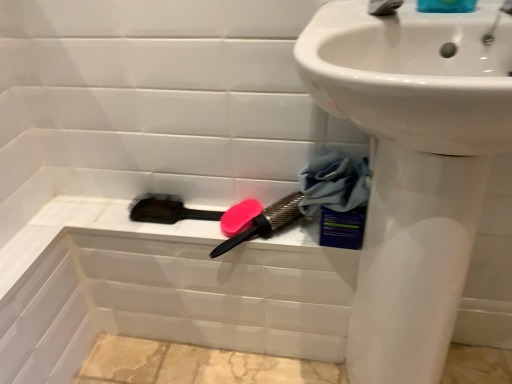
Describe the element at coordinates (334, 184) in the screenshot. I see `blue fabric at lower right` at that location.

Find the location of a particular element. This screenshot has height=384, width=512. blue fabric at lower right is located at coordinates (334, 184).

The height and width of the screenshot is (384, 512). What are the coordinates of `blue glossy soap at upper right` in the screenshot? It's located at (446, 6).

Measure the distance between point (270, 215) and camera.

Point (270, 215) and camera are 91.20 centimeters apart.

This screenshot has width=512, height=384. Find the location of `blue fabric at lower right`. blue fabric at lower right is located at coordinates (334, 184).

How much distance is there between black bristle brush at lower center, which ranks as the 1th brush in left-to-right order, and pink rubber brush at upper center, which appears as the 1th brush when viewed from the right?

A distance of 5.33 inches exists between black bristle brush at lower center, which ranks as the 1th brush in left-to-right order, and pink rubber brush at upper center, which appears as the 1th brush when viewed from the right.

Is pink rubber brush at upper center, which appears as the 1th brush when viewed from the right, at the back of black bristle brush at lower center, positioned as the 2th brush in right-to-left order?

That's not correct — black bristle brush at lower center, positioned as the 2th brush in right-to-left order, is not looking away from pink rubber brush at upper center, which appears as the 1th brush when viewed from the right.

From a real-world perspective, is black bristle brush at lower center, which ranks as the 1th brush in left-to-right order, physically below pink rubber brush at upper center, the 2th brush positioned from the left?

Yes.

Does pink rubber brush at upper center, which appears as the 1th brush when viewed from the right, touch blue glossy soap at upper right?

No, pink rubber brush at upper center, which appears as the 1th brush when viewed from the right, is not touching blue glossy soap at upper right.

Is pink rubber brush at upper center, the 2th brush positioned from the left, facing towards blue glossy soap at upper right?

No, pink rubber brush at upper center, the 2th brush positioned from the left, is not oriented towards blue glossy soap at upper right.

From the picture: From the image's perspective, is pink rubber brush at upper center, the 2th brush positioned from the left, beneath blue glossy soap at upper right?

Correct, pink rubber brush at upper center, the 2th brush positioned from the left, appears lower than blue glossy soap at upper right in the image.

Considering the relative positions of pink rubber brush at upper center, which appears as the 1th brush when viewed from the right, and blue glossy soap at upper right in the image provided, is pink rubber brush at upper center, which appears as the 1th brush when viewed from the right, to the left or to the right of blue glossy soap at upper right?

Based on their positions, pink rubber brush at upper center, which appears as the 1th brush when viewed from the right, is located to the left of blue glossy soap at upper right.

Who is taller, silver metallic tap at upper right or black bristle brush at lower center, positioned as the 2th brush in right-to-left order?

silver metallic tap at upper right.

Is silver metallic tap at upper right oriented away from black bristle brush at lower center, positioned as the 2th brush in right-to-left order?

silver metallic tap at upper right does not have its back to black bristle brush at lower center, positioned as the 2th brush in right-to-left order.

Considering the relative sizes of silver metallic tap at upper right and black bristle brush at lower center, which ranks as the 1th brush in left-to-right order, in the image provided, is silver metallic tap at upper right bigger than black bristle brush at lower center, which ranks as the 1th brush in left-to-right order,?

No, silver metallic tap at upper right is not bigger than black bristle brush at lower center, which ranks as the 1th brush in left-to-right order.

Is silver metallic tap at upper right wider than black bristle brush at lower center, which ranks as the 1th brush in left-to-right order?

Indeed, silver metallic tap at upper right has a greater width compared to black bristle brush at lower center, which ranks as the 1th brush in left-to-right order.

Which of these two, white glossy sink at upper right or black bristle brush at lower center, positioned as the 2th brush in right-to-left order, is thinner?

Thinner between the two is black bristle brush at lower center, positioned as the 2th brush in right-to-left order.

Considering the positions of objects white glossy sink at upper right and black bristle brush at lower center, positioned as the 2th brush in right-to-left order, in the image provided, who is in front, white glossy sink at upper right or black bristle brush at lower center, positioned as the 2th brush in right-to-left order,?

white glossy sink at upper right.

In the scene shown: Considering the relative sizes of white glossy sink at upper right and black bristle brush at lower center, which ranks as the 1th brush in left-to-right order, in the image provided, is white glossy sink at upper right taller than black bristle brush at lower center, which ranks as the 1th brush in left-to-right order,?

Yes.

Looking at this image, who is smaller, white glossy sink at upper right or black bristle brush at lower center, positioned as the 2th brush in right-to-left order?

Smaller between the two is black bristle brush at lower center, positioned as the 2th brush in right-to-left order.

Is pink rubber brush at upper center, which appears as the 1th brush when viewed from the right, facing towards silver metallic tap at upper right?

No, pink rubber brush at upper center, which appears as the 1th brush when viewed from the right, is not aimed at silver metallic tap at upper right.

Is silver metallic tap at upper right located within pink rubber brush at upper center, which appears as the 1th brush when viewed from the right?

That's incorrect, silver metallic tap at upper right is not inside pink rubber brush at upper center, which appears as the 1th brush when viewed from the right.

Who is bigger, pink rubber brush at upper center, which appears as the 1th brush when viewed from the right, or silver metallic tap at upper right?

pink rubber brush at upper center, which appears as the 1th brush when viewed from the right, is bigger.

Find the location of a particular element. This screenshot has width=512, height=384. tap in front of the pink rubber brush at upper center, which appears as the 1th brush when viewed from the right is located at coordinates (384, 7).

In the scene shown: Considering the relative sizes of blue fabric at lower right and pink rubber brush at upper center, the 2th brush positioned from the left, in the image provided, is blue fabric at lower right wider than pink rubber brush at upper center, the 2th brush positioned from the left,?

In fact, blue fabric at lower right might be narrower than pink rubber brush at upper center, the 2th brush positioned from the left.

Looking at this image, from a real-world perspective, which object stands above the other?

blue fabric at lower right is physically above.

Based on the photo, which is less distant, [332,161] or [289,212]?

Point [332,161].

From the image's perspective, between blue fabric at lower right and pink rubber brush at upper center, the 2th brush positioned from the left, who is located below?

pink rubber brush at upper center, the 2th brush positioned from the left.

Measure the distance from white glossy sink at upper right to blue glossy soap at upper right.

white glossy sink at upper right is 34.06 centimeters from blue glossy soap at upper right.

Does point (372, 131) come in front of point (448, 0)?

Yes, point (372, 131) is in front of point (448, 0).

From a real-world perspective, between white glossy sink at upper right and blue glossy soap at upper right, who is vertically lower?

In real-world perspective, white glossy sink at upper right is lower.

Considering the sizes of white glossy sink at upper right and blue glossy soap at upper right in the image, is white glossy sink at upper right bigger or smaller than blue glossy soap at upper right?

white glossy sink at upper right is bigger than blue glossy soap at upper right.

In the image, there is a pink rubber brush at upper center, the 2th brush positioned from the left. Identify the location of brush below it (from a real-world perspective). (166, 210).

Find the location of a particular element. liquid located on the right of pink rubber brush at upper center, which appears as the 1th brush when viewed from the right is located at coordinates (446, 6).

From the image, which object appears to be nearer to pink rubber brush at upper center, which appears as the 1th brush when viewed from the right, blue glossy soap at upper right or silver metallic tap at upper right?

Among the two, silver metallic tap at upper right is located nearer to pink rubber brush at upper center, which appears as the 1th brush when viewed from the right.

Looking at the image, which one is located further to pink matte soap at center, pink rubber brush at upper center, which appears as the 1th brush when viewed from the right, or silver metallic tap at upper right?

silver metallic tap at upper right is positioned further to the anchor pink matte soap at center.

Looking at the image, which one is located further to blue glossy soap at upper right, blue fabric at lower right or silver metallic tap at upper right?

The object further to blue glossy soap at upper right is blue fabric at lower right.

Estimate the real-world distances between objects in this image. Which object is closer to blue fabric at lower right, pink rubber brush at upper center, which appears as the 1th brush when viewed from the right, or silver metallic tap at upper right?

Based on the image, pink rubber brush at upper center, which appears as the 1th brush when viewed from the right, appears to be nearer to blue fabric at lower right.

From the image, which object appears to be farther from silver metallic tap at upper right, white glossy sink at upper right or blue glossy soap at upper right?

Based on the image, white glossy sink at upper right appears to be further to silver metallic tap at upper right.

Consider the image. Looking at the image, which one is located closer to black bristle brush at lower center, positioned as the 2th brush in right-to-left order, blue glossy soap at upper right or pink rubber brush at upper center, which appears as the 1th brush when viewed from the right?

pink rubber brush at upper center, which appears as the 1th brush when viewed from the right, lies closer to black bristle brush at lower center, positioned as the 2th brush in right-to-left order, than the other object.

Which object lies nearer to the anchor point blue fabric at lower right, pink rubber brush at upper center, the 2th brush positioned from the left, or blue glossy soap at upper right?

pink rubber brush at upper center, the 2th brush positioned from the left.

Looking at the image, which one is located further to pink matte soap at center, white glossy sink at upper right or blue fabric at lower right?

Based on the image, white glossy sink at upper right appears to be further to pink matte soap at center.

Image resolution: width=512 pixels, height=384 pixels. I want to click on soap that lies between silver metallic tap at upper right and pink rubber brush at upper center, which appears as the 1th brush when viewed from the right, from top to bottom, so click(240, 217).

In order to click on brush located between black bristle brush at lower center, positioned as the 2th brush in right-to-left order, and blue glossy soap at upper right in the left-right direction in this screenshot , I will do `click(266, 223)`.

Find the location of `clothe between blue glossy soap at upper right and pink rubber brush at upper center, the 2th brush positioned from the left, from top to bottom`. clothe between blue glossy soap at upper right and pink rubber brush at upper center, the 2th brush positioned from the left, from top to bottom is located at coordinates (334, 184).

The height and width of the screenshot is (384, 512). What are the coordinates of `soap between blue glossy soap at upper right and pink rubber brush at upper center, the 2th brush positioned from the left, from top to bottom` in the screenshot? It's located at (240, 217).